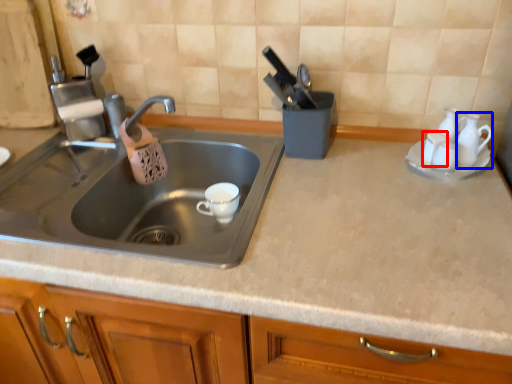
Question: Which point is further to the camera, tableware (highlighted by a red box) or tableware (highlighted by a blue box)?

Choices:
 (A) tableware
 (B) tableware

Answer: (A)